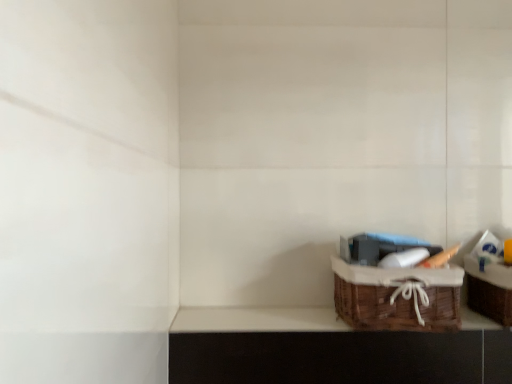
Identify the location of woven brown basket at lower right. The height and width of the screenshot is (384, 512). (489, 290).

The height and width of the screenshot is (384, 512). What are the coordinates of `brown wicker basket at lower right` in the screenshot? It's located at (256, 320).

In order to face brown wicker basket at lower right, should I rotate leftwards or rightwards?

Turn right approximately 11.155 degrees to face it.

Locate an element on the screen. The height and width of the screenshot is (384, 512). woven brown basket at lower right is located at coordinates (489, 290).

Measure the distance between woven brown basket at lower right and brown wicker basket at lower right.

woven brown basket at lower right and brown wicker basket at lower right are 16.73 inches apart.

Is woven brown basket at lower right not near brown wicker basket at lower right?

woven brown basket at lower right is actually quite close to brown wicker basket at lower right.

Could you tell me if woven brown basket at lower right is turned towards brown wicker basket at lower right?

No, woven brown basket at lower right is not turned towards brown wicker basket at lower right.

Looking at their sizes, would you say woven brown basket at lower right is wider or thinner than brown wicker basket at lower right?

Clearly, woven brown basket at lower right has more width compared to brown wicker basket at lower right.

Is brown wicker basket at lower right at the right side of woven brown basket at lower right?

No.

In the image, is brown wicker basket at lower right positioned in front of or behind woven brown basket at lower right?

Clearly, brown wicker basket at lower right is behind woven brown basket at lower right.

Between point (337, 330) and point (493, 292), which one is positioned behind?

The point (493, 292) is behind.

Which of these two, brown wicker basket at lower right or woven brown basket at lower right, is smaller?

With smaller size is brown wicker basket at lower right.

From the image's perspective, is woven brown picnic basket at lower right below brown wicker basket at lower right?

No.

Is woven brown picnic basket at lower right oriented towards brown wicker basket at lower right?

No, woven brown picnic basket at lower right is not oriented towards brown wicker basket at lower right.

From a real-world perspective, is woven brown picnic basket at lower right below brown wicker basket at lower right?

No, from a real-world perspective, woven brown picnic basket at lower right is not under brown wicker basket at lower right.

Find the location of a particular element. Image resolution: width=512 pixels, height=384 pixels. window sill on the left of woven brown picnic basket at lower right is located at coordinates (256, 320).

You are a GUI agent. You are given a task and a screenshot of the screen. Output one action in this format:
    pyautogui.click(x=<x>, y=<y>)
    Task: Click on the cabinetry behind the woven brown picnic basket at lower right
    This screenshot has height=384, width=512.
    Given the screenshot: What is the action you would take?
    point(489,290)

Does woven brown basket at lower right appear on the left side of woven brown picnic basket at lower right?

Incorrect, woven brown basket at lower right is not on the left side of woven brown picnic basket at lower right.

Could you tell me if woven brown basket at lower right is turned towards woven brown picnic basket at lower right?

No.

Which is in front, point (472, 306) or point (445, 304)?

Positioned in front is point (445, 304).

Which is more to the left, brown wicker basket at lower right or woven brown picnic basket at lower right?

brown wicker basket at lower right is more to the left.

From a real-world perspective, between brown wicker basket at lower right and woven brown picnic basket at lower right, who is vertically lower?

brown wicker basket at lower right, from a real-world perspective.

Which object is further away from the camera taking this photo, brown wicker basket at lower right or woven brown picnic basket at lower right?

brown wicker basket at lower right.

Considering the sizes of objects brown wicker basket at lower right and woven brown picnic basket at lower right in the image provided, who is wider, brown wicker basket at lower right or woven brown picnic basket at lower right?

With larger width is woven brown picnic basket at lower right.

Looking at this image, from the image's perspective, is woven brown picnic basket at lower right on woven brown basket at lower right?

No, from the image's perspective, woven brown picnic basket at lower right is not over woven brown basket at lower right.

You are a GUI agent. You are given a task and a screenshot of the screen. Output one action in this format:
    pyautogui.click(x=<x>, y=<y>)
    Task: Click on the picnic basket to the left of woven brown basket at lower right
    The image size is (512, 384).
    Given the screenshot: What is the action you would take?
    [x=397, y=297]

Does point (339, 307) come in front of point (471, 273)?

That is True.

Which is behind, woven brown picnic basket at lower right or woven brown basket at lower right?

woven brown basket at lower right is behind.

I want to click on cabinetry that is on the right side of brown wicker basket at lower right, so click(x=489, y=290).

Identify the location of window sill located underneath the woven brown basket at lower right (from a real-world perspective). The image size is (512, 384). (256, 320).

Based on their spatial positions, is brown wicker basket at lower right or woven brown basket at lower right closer to woven brown picnic basket at lower right?

Based on the image, brown wicker basket at lower right appears to be nearer to woven brown picnic basket at lower right.

When comparing their distances from woven brown basket at lower right, does brown wicker basket at lower right or woven brown picnic basket at lower right seem further?

brown wicker basket at lower right.

Based on their spatial positions, is woven brown basket at lower right or woven brown picnic basket at lower right closer to brown wicker basket at lower right?

woven brown picnic basket at lower right is closer to brown wicker basket at lower right.

Based on their spatial positions, is woven brown picnic basket at lower right or woven brown basket at lower right closer to brown wicker basket at lower right?

woven brown picnic basket at lower right is closer to brown wicker basket at lower right.

Based on their spatial positions, is woven brown basket at lower right or brown wicker basket at lower right closer to woven brown picnic basket at lower right?

brown wicker basket at lower right lies closer to woven brown picnic basket at lower right than the other object.

Estimate the real-world distances between objects in this image. Which object is further from woven brown basket at lower right, woven brown picnic basket at lower right or brown wicker basket at lower right?

brown wicker basket at lower right is positioned further to the anchor woven brown basket at lower right.

Where is `picnic basket situated between brown wicker basket at lower right and woven brown basket at lower right from left to right`? The image size is (512, 384). picnic basket situated between brown wicker basket at lower right and woven brown basket at lower right from left to right is located at coordinates (397, 297).